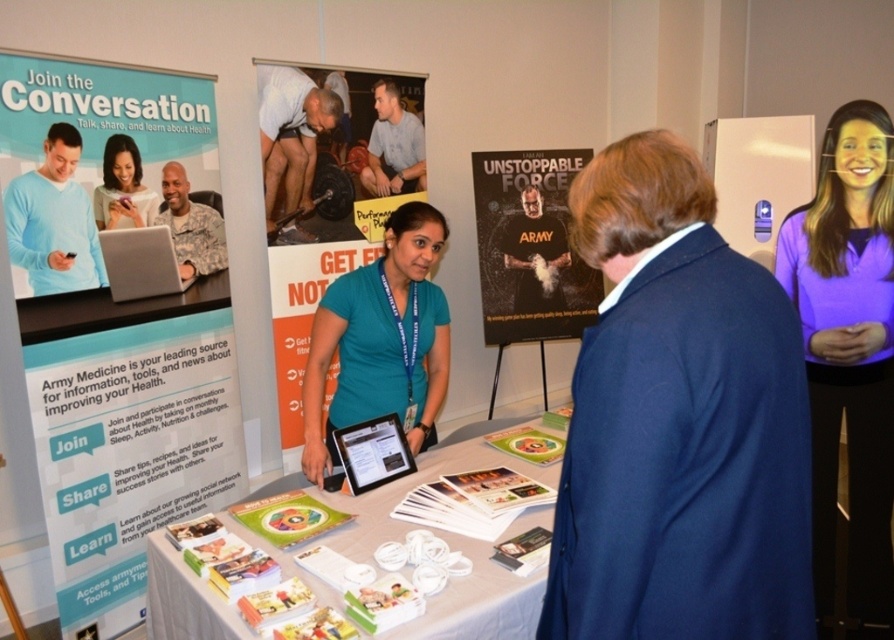
You are attending a health event and want to approach the table. From your current position, which of the two points, point (179, 632) or point (294, 230), is closer to you?

Point (179, 632) is in front of point (294, 230), so it is closer to you.